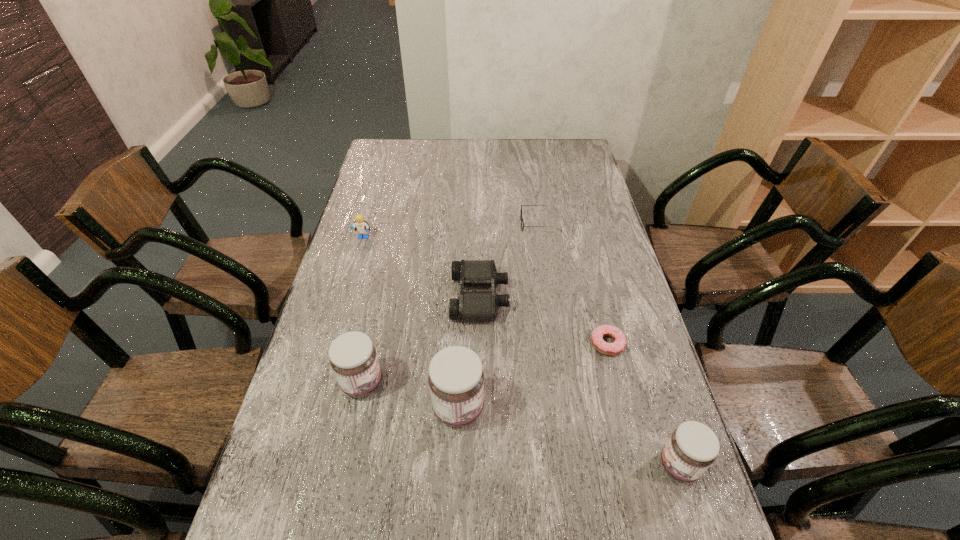
This screenshot has height=540, width=960. I want to click on vacant region at the right edge, so click(x=594, y=209).

This screenshot has height=540, width=960. What are the coordinates of `empty space between the nearest object and the second jam from left to right` in the screenshot? It's located at (568, 437).

The image size is (960, 540). In order to click on free space between the sixth tallest object and the fifth tallest object in this screenshot , I will do `click(510, 260)`.

Image resolution: width=960 pixels, height=540 pixels. I want to click on vacant area that lies between the second tallest object and the nearest object, so click(520, 424).

Locate an element on the screen. This screenshot has height=540, width=960. vacant space in between the fifth nearest object and the fourth farthest object is located at coordinates (543, 320).

Where is `vacant area that lies between the fifth shortest object and the fourth farthest object`? The width and height of the screenshot is (960, 540). vacant area that lies between the fifth shortest object and the fourth farthest object is located at coordinates (643, 404).

Find the location of a particular element. This screenshot has width=960, height=540. vacant area that lies between the fourth shortest object and the fourth nearest object is located at coordinates (486, 291).

What are the coordinates of `free space between the doughnut and the fourth shortest object` in the screenshot? It's located at (486, 291).

Locate an element on the screen. empty location between the second jam from right to left and the rightmost jam is located at coordinates (x=568, y=437).

Identify the location of vacant point located between the sixth shortest object and the fourth nearest object. The height and width of the screenshot is (540, 960). (485, 363).